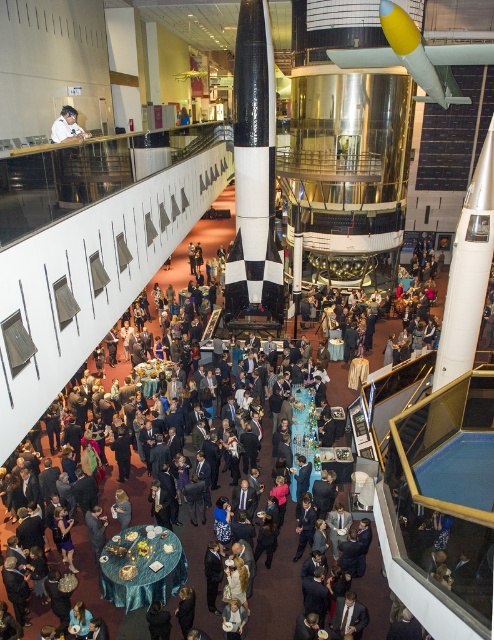
Does white glossy rocket at center have a smaller size compared to blue satin table at center?

Indeed, white glossy rocket at center has a smaller size compared to blue satin table at center.

In the scene shown: Can you confirm if white glossy rocket at center is positioned below blue satin table at center?

Actually, white glossy rocket at center is above blue satin table at center.

This screenshot has width=494, height=640. Identify the location of white glossy rocket at center. (467, 273).

Is point (240, 241) less distant than point (75, 115)?

No, (240, 241) is behind (75, 115).

Who is more forward, (245,12) or (58,129)?

Point (58,129)

Identify the location of black-and-white checkered missile at center. (253, 168).

Does black-and-white checkered missile at center appear under white glossy rocket at center?

Incorrect, black-and-white checkered missile at center is not positioned below white glossy rocket at center.

Who is lower down, black-and-white checkered missile at center or white glossy rocket at center?

white glossy rocket at center is below.

The height and width of the screenshot is (640, 494). I want to click on black-and-white checkered missile at center, so click(253, 168).